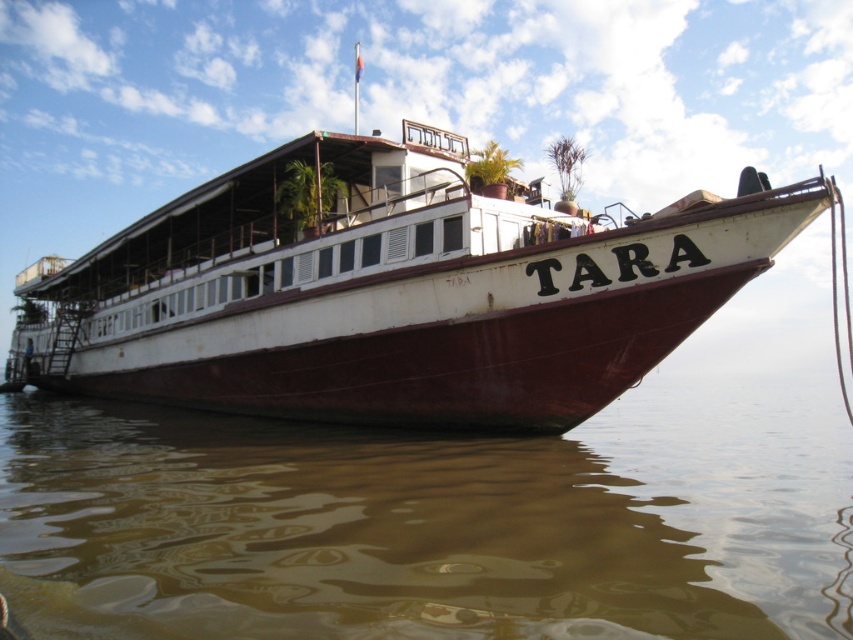
Question: Among these objects, which one is nearest to the camera?

Choices:
 (A) brown matte water at lower center
 (B) rustic wood boat at center

Answer: (A)

Question: Can you confirm if brown matte water at lower center is positioned to the left of rustic wood boat at center?

Choices:
 (A) no
 (B) yes

Answer: (B)

Question: Which point is closer to the camera taking this photo?

Choices:
 (A) pyautogui.click(x=622, y=605)
 (B) pyautogui.click(x=173, y=332)

Answer: (A)

Question: Is brown matte water at lower center smaller than rustic wood boat at center?

Choices:
 (A) yes
 (B) no

Answer: (A)

Question: Does brown matte water at lower center have a greater width compared to rustic wood boat at center?

Choices:
 (A) yes
 (B) no

Answer: (B)

Question: Which point is closer to the camera?

Choices:
 (A) rustic wood boat at center
 (B) brown matte water at lower center

Answer: (B)